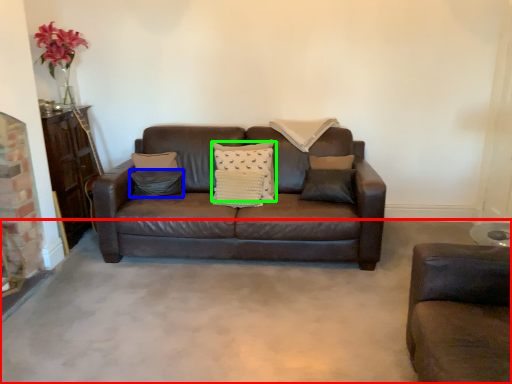
Question: Which object is positioned closest to concrete (highlighted by a red box)? Select from pillow (highlighted by a blue box) and pillow (highlighted by a green box).

Choices:
 (A) pillow
 (B) pillow

Answer: (B)